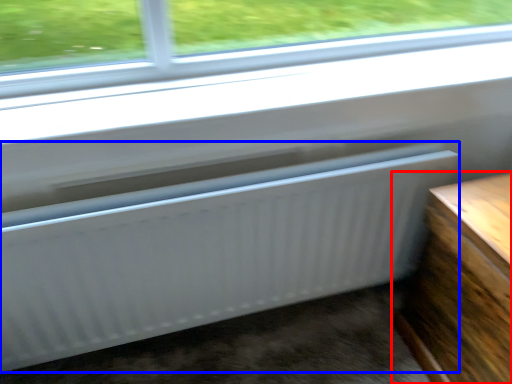
Question: Among these objects, which one is nearest to the camera, furniture (highlighted by a red box) or radiator (highlighted by a blue box)?

Choices:
 (A) furniture
 (B) radiator

Answer: (A)